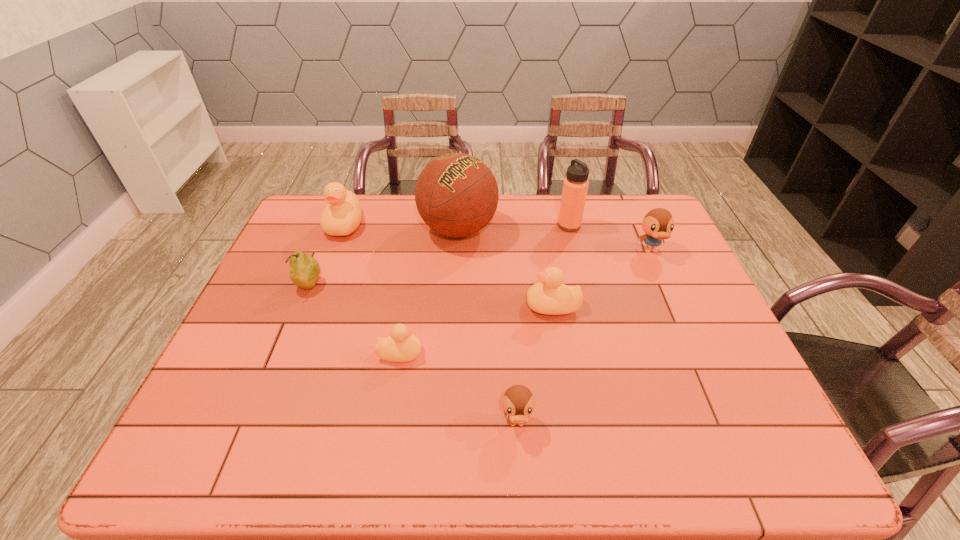
You are a GUI agent. You are given a task and a screenshot of the screen. Output one action in this format:
    pyautogui.click(x=<x>, y=<y>)
    Task: Click on the unoccupied area between the right blue duck and the seventh farthest object
    The height and width of the screenshot is (540, 960).
    Given the screenshot: What is the action you would take?
    pyautogui.click(x=525, y=302)

You are a GUI agent. You are given a task and a screenshot of the screen. Output one action in this format:
    pyautogui.click(x=<x>, y=<y>)
    Task: Click on the vacant point located between the rightmost object and the basketball
    
    Given the screenshot: What is the action you would take?
    pyautogui.click(x=555, y=240)

The image size is (960, 540). Identify the location of empty space that is in between the second yellow duck from left to right and the rightmost yellow duck. (476, 329).

I want to click on free space between the nearest duck and the farthest yellow duck, so click(x=431, y=324).

This screenshot has height=540, width=960. What are the coordinates of `free space between the farthest yellow duck and the smaller blue duck` in the screenshot? It's located at (431, 324).

Where is `vacant point located between the basketball and the nearest yellow duck`? The width and height of the screenshot is (960, 540). vacant point located between the basketball and the nearest yellow duck is located at coordinates (429, 291).

Select which object is the closest to the pear. Please provide its 2D coordinates. Your answer should be formatted as a tuple, i.e. [(x, y)], where the tuple contains the x and y coordinates of a point satisfying the conditions above.

[(342, 216)]

Where is `the closest object to the second farthest yellow duck`? The width and height of the screenshot is (960, 540). the closest object to the second farthest yellow duck is located at coordinates (456, 194).

Choose which duck is the nearest neighbor to the fourth farthest duck. Please provide its 2D coordinates. Your answer should be formatted as a tuple, i.e. [(x, y)], where the tuple contains the x and y coordinates of a point satisfying the conditions above.

[(518, 402)]

In order to click on the third closest duck to the nearer blue duck in this screenshot , I will do `click(658, 224)`.